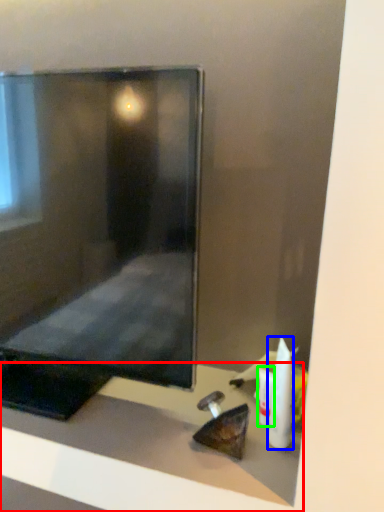
Question: Which object is positioned closest to furniture (highlighted by a red box)? Select from toiletry (highlighted by a blue box) and toiletry (highlighted by a green box).

Choices:
 (A) toiletry
 (B) toiletry

Answer: (B)